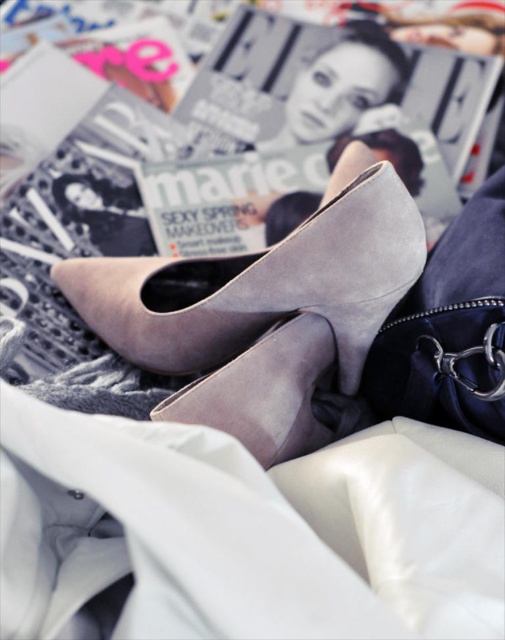
Who is positioned more to the left, suede high-heeled shoe at center or suede-like beige shoe at upper center?

Positioned to the left is suede high-heeled shoe at center.

Does point (146, 285) come farther from viewer compared to point (328, 80)?

No, (146, 285) is closer to viewer.

Image resolution: width=505 pixels, height=640 pixels. Identify the location of suede high-heeled shoe at center. (261, 285).

Is suede gray shoe at center to the left of suede-like beige shoe at upper center from the viewer's perspective?

Indeed, suede gray shoe at center is positioned on the left side of suede-like beige shoe at upper center.

Between point (252, 364) and point (375, 68), which one is positioned behind?

Point (375, 68)

Which is in front, point (235, 404) or point (333, 88)?

Positioned in front is point (235, 404).

You are a GUI agent. You are given a task and a screenshot of the screen. Output one action in this format:
    pyautogui.click(x=<x>, y=<y>)
    Task: Click on the suede gray shoe at center
    The height and width of the screenshot is (640, 505).
    Given the screenshot: What is the action you would take?
    pyautogui.click(x=273, y=394)

Locate an element on the screen. This screenshot has width=505, height=640. suede high-heeled shoe at center is located at coordinates (261, 285).

How far apart are suede high-heeled shoe at center and suede gray shoe at center?

4.67 inches

Image resolution: width=505 pixels, height=640 pixels. Identify the location of suede high-heeled shoe at center. (261, 285).